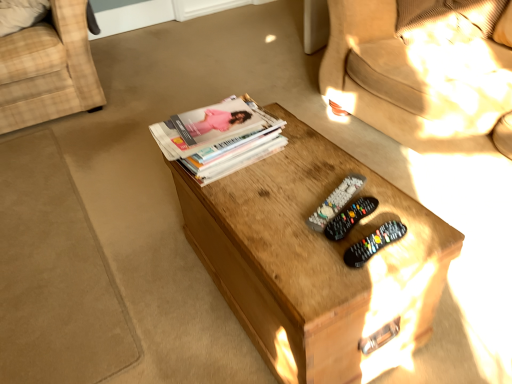
You are a GUI agent. You are given a task and a screenshot of the screen. Output one action in this format:
    pyautogui.click(x=<x>, y=<y>)
    Task: Click on the unoccupied space behind black plastic remote controls at center, which ranks as the first remote control in front-to-back order
    The image size is (512, 384).
    Given the screenshot: What is the action you would take?
    pyautogui.click(x=339, y=184)